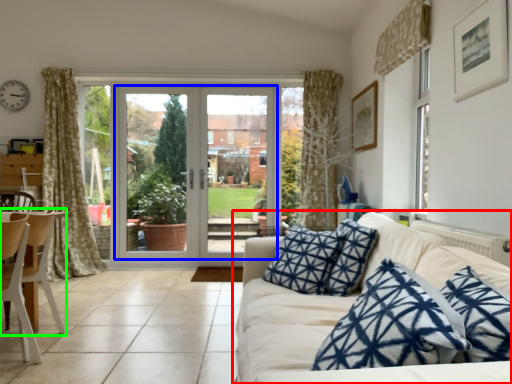
Question: Which object is positioned closest to studio couch (highlighted by a red box)? Select from door (highlighted by a blue box) and chair (highlighted by a green box).

Choices:
 (A) door
 (B) chair

Answer: (B)